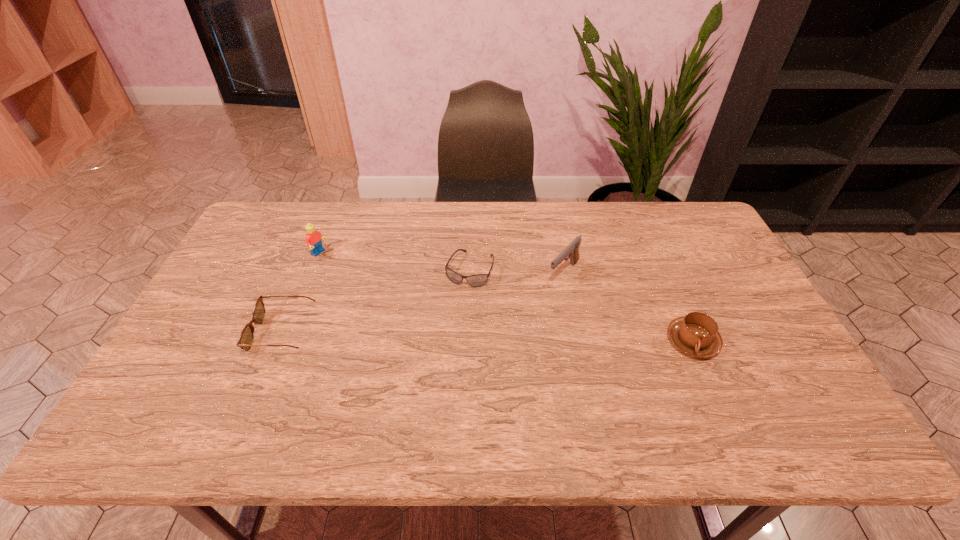
At what (x,y) coordinates should I click in order to perform the action: click on spectacles. Please return your answer as a coordinate pair (x, y). Looking at the image, I should click on (245, 341).

Locate an element on the screen. The height and width of the screenshot is (540, 960). cappuccino is located at coordinates (696, 334).

You are a GUI agent. You are given a task and a screenshot of the screen. Output one action in this format:
    pyautogui.click(x=<x>, y=<y>)
    Task: Click on the pistol
    The height and width of the screenshot is (540, 960).
    Given the screenshot: What is the action you would take?
    pyautogui.click(x=571, y=251)

The width and height of the screenshot is (960, 540). I want to click on sunglasses, so click(x=478, y=280).

Find the location of a particular element. the third object from right to left is located at coordinates (478, 280).

Locate an element on the screen. This screenshot has height=540, width=960. Lego is located at coordinates (313, 237).

Where is `free space located at the front view of the spectacles`? This screenshot has height=540, width=960. free space located at the front view of the spectacles is located at coordinates (189, 333).

You are a GUI agent. You are given a task and a screenshot of the screen. Output one action in this format:
    pyautogui.click(x=<x>, y=<y>)
    Task: Click on the free space located 0.090m on the side of the cappuccino with the handle
    
    Given the screenshot: What is the action you would take?
    pyautogui.click(x=715, y=394)

Identify the location of free space located 0.110m at the barrel of the fourth object from left to right. The height and width of the screenshot is (540, 960). (534, 307).

Where is `free space located 0.050m at the barrel of the fourth object from left to right`? The width and height of the screenshot is (960, 540). free space located 0.050m at the barrel of the fourth object from left to right is located at coordinates (545, 295).